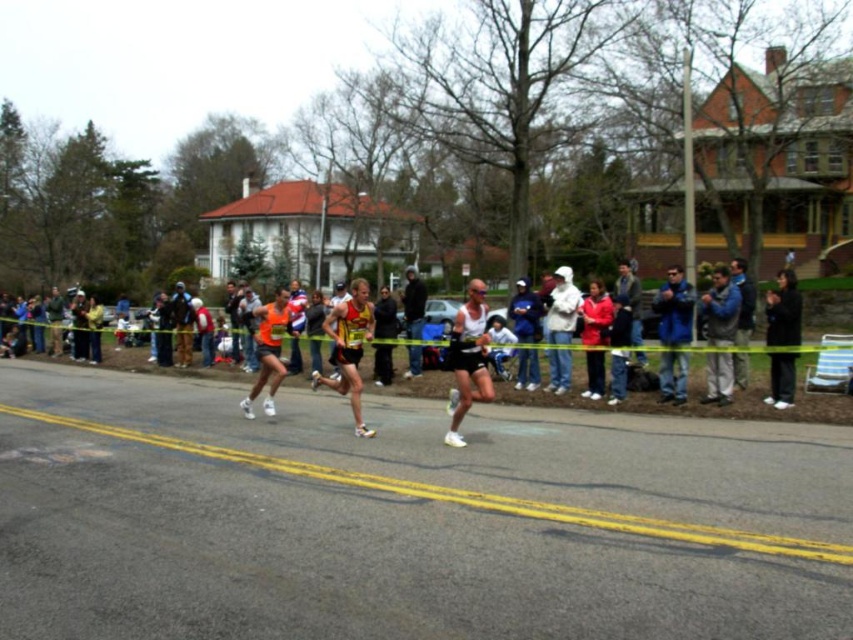
Which is more to the right, yellow asphalt at center or yellow and red running suit at center?

yellow asphalt at center

Is point (440, 486) farther from camera compared to point (361, 337)?

No, (440, 486) is closer to viewer.

Locate an element on the screen. yellow asphalt at center is located at coordinates (471, 496).

Can you confirm if blue fleece jacket at right is positioned above white cotton jacket at center?

Incorrect, blue fleece jacket at right is not positioned above white cotton jacket at center.

Consider the image. Does blue fleece jacket at right lie behind white cotton jacket at center?

No.

Who is more forward, [714,381] or [553,276]?

Point [714,381]

The height and width of the screenshot is (640, 853). I want to click on blue fleece jacket at right, so click(x=718, y=308).

Is point (457, 317) positioned before point (560, 339)?

Yes, it is.

Which is behind, point (483, 348) or point (555, 346)?

Point (555, 346)

Between point (476, 360) and point (552, 289), which one is positioned in front?

Positioned in front is point (476, 360).

Identify the location of white matte tank top at center. Image resolution: width=853 pixels, height=640 pixels. (468, 358).